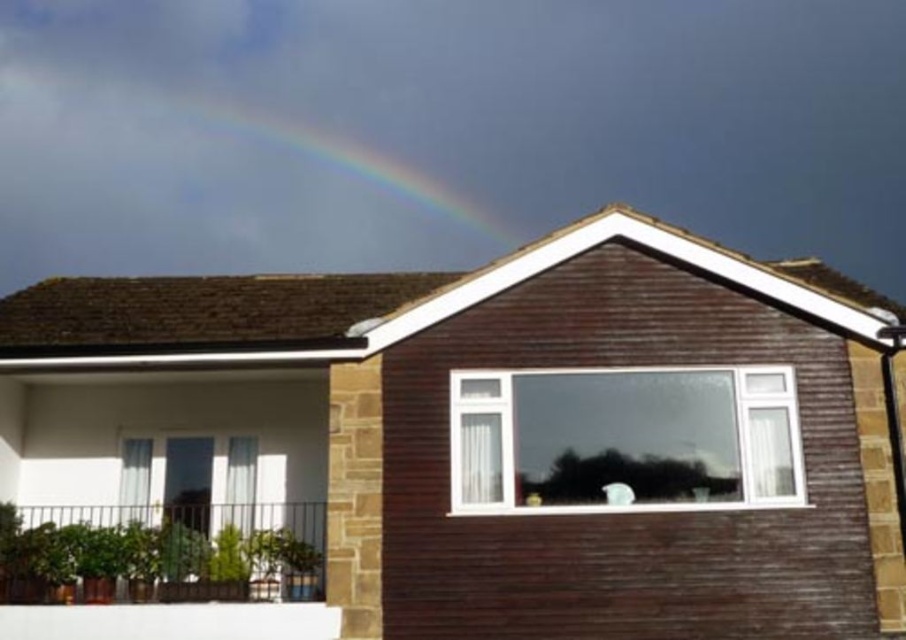
Is clear glass window at center bigger than rainbow at upper center?

Actually, clear glass window at center might be smaller than rainbow at upper center.

Does clear glass window at center have a greater width compared to rainbow at upper center?

Incorrect, clear glass window at center's width does not surpass rainbow at upper center's.

Find the location of a particular element. clear glass window at center is located at coordinates (624, 440).